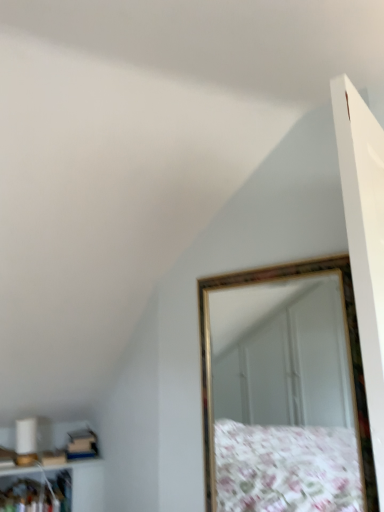
Identify the location of vacant point above white glossy cabinet at lower left (from a real-world perspective). The image size is (384, 512). (45, 472).